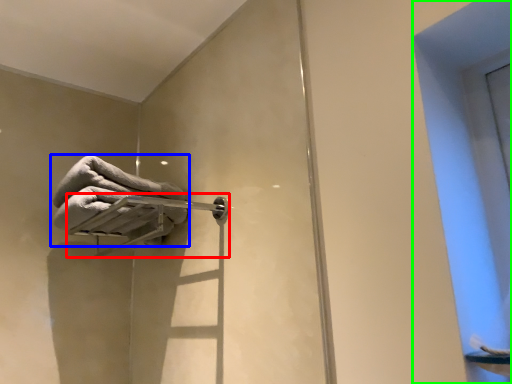
Question: Which object is the closest to the towel bar (highlighted by a red box)? Choose among these: towel (highlighted by a blue box) or window (highlighted by a green box).

Choices:
 (A) towel
 (B) window

Answer: (A)